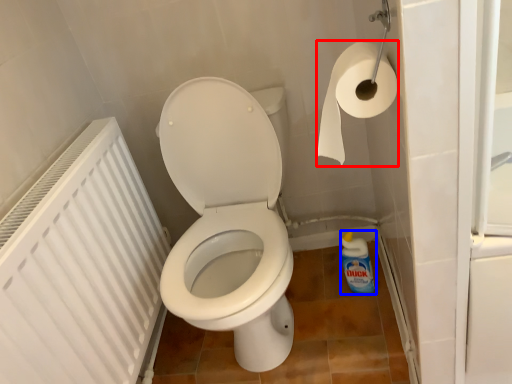
Question: Which object is closer to the camera taking this photo, toilet paper (highlighted by a red box) or cleaning product (highlighted by a blue box)?

Choices:
 (A) toilet paper
 (B) cleaning product

Answer: (A)